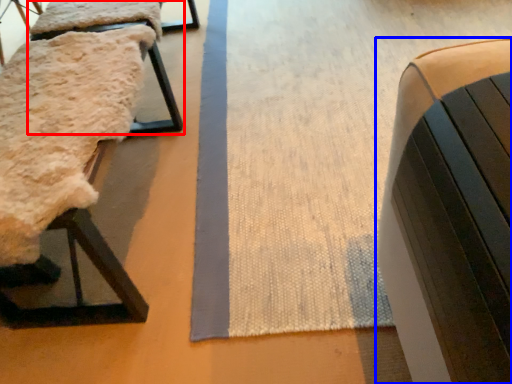
Question: Which point is closer to the camera, furniture (highlighted by a red box) or furniture (highlighted by a blue box)?

Choices:
 (A) furniture
 (B) furniture

Answer: (B)